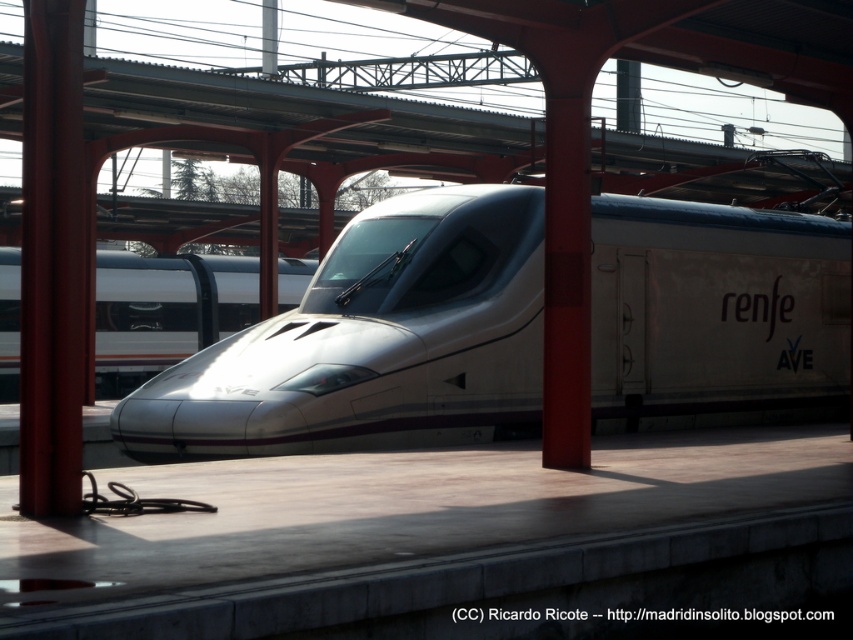
You are a maintenance worker needing to inspect both the sleek silver train at center and the white glossy train at center. Given that your inspection equipment has a maximum reach of 20 meters, can you inspect both trains without moving your equipment closer than 5 meters from each train?

The distance between the sleek silver train at center and the white glossy train at center is 21.34 meters. Since the equipment has a maximum reach of 20 meters and must stay at least 5 meters away from each train, the total required distance would be 20 meters. However, the actual distance is 21.34 meters, which exceeds the equipment reach. Therefore, you cannot inspect both trains without moving closer than 5 meters.

You are a photographer standing on the platform and want to capture both the sleek silver train at center and the white glossy train at center in a single photo. Which train should you position closer to the camera to ensure both are fully visible in the frame?

To ensure both the sleek silver train at center and the white glossy train at center are fully visible in the frame, you should position the sleek silver train at center closer to the camera since it is larger in size than the white glossy train at center. This way, the larger train will take up more space near the camera, while the smaller one can be placed slightly farther back, allowing both to fit within the photo.